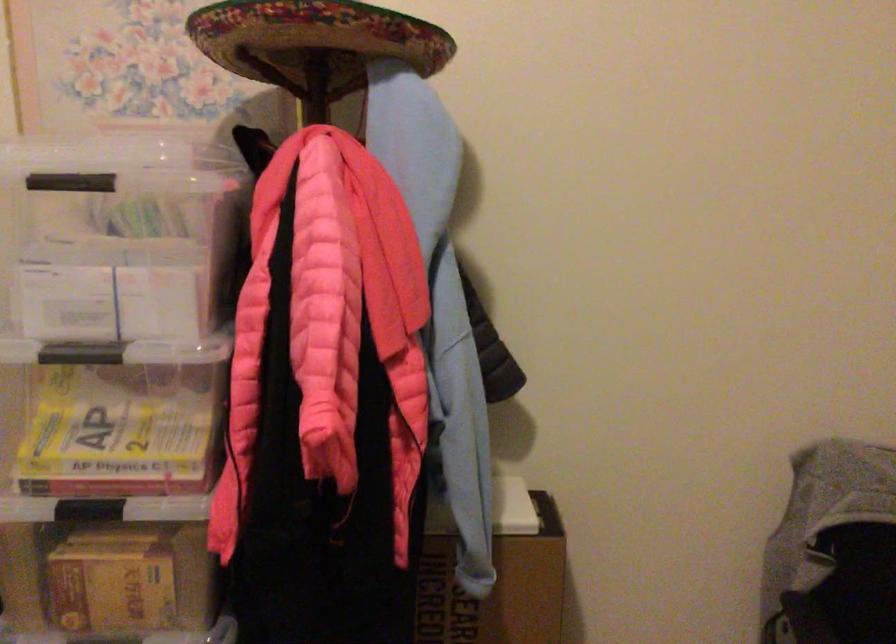
This screenshot has height=644, width=896. What do you see at coordinates (71, 181) in the screenshot?
I see `the black bin latch` at bounding box center [71, 181].